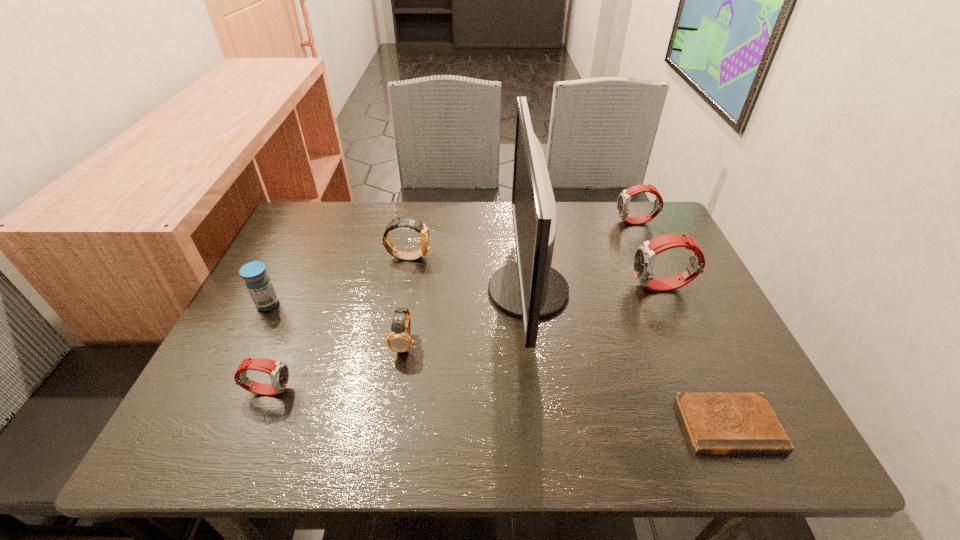
Locate an element on the screen. the second closest watch relative to the third farthest watch is located at coordinates (422, 229).

Point out which red watch is positioned as the second nearest to the tallest object. Please provide its 2D coordinates. Your answer should be formatted as a tuple, i.e. [(x, y)], where the tuple contains the x and y coordinates of a point satisfying the conditions above.

[(623, 203)]

Where is `red watch that is the second closest to the diary`? red watch that is the second closest to the diary is located at coordinates (623, 203).

What are the coordinates of `free spot that satisfies the following two spatial constraints: 1. on the face of the fourth nearest watch; 2. on the front side of the blue medicine` in the screenshot? It's located at [399, 304].